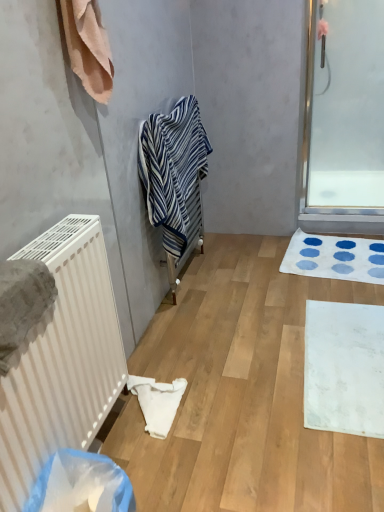
Image resolution: width=384 pixels, height=512 pixels. Identify the location of spots to the right of white fabric towel at lower center. (208, 404).